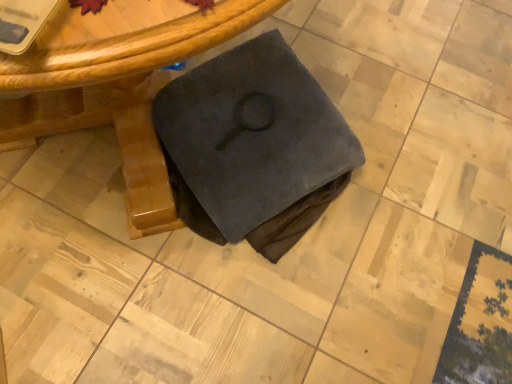
You are a GUI agent. You are given a task and a screenshot of the screen. Output one action in this format:
    pyautogui.click(x=<x>, y=<y>)
    Task: Click on the free spot in front of dark suede book at center
    
    Given the screenshot: What is the action you would take?
    228,305